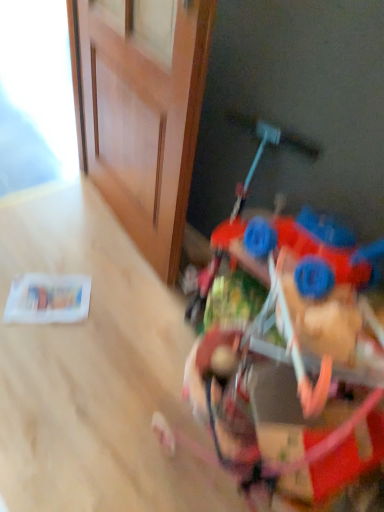
In order to face wooden door at upper left, should I rotate leftwards or rightwards?

Rotate left and turn 11.031 degrees.

The height and width of the screenshot is (512, 384). What do you see at coordinates (143, 116) in the screenshot?
I see `wooden door at upper left` at bounding box center [143, 116].

This screenshot has width=384, height=512. I want to click on wooden door at upper left, so click(143, 116).

You are a GUI agent. You are given a task and a screenshot of the screen. Output one action in this format:
    pyautogui.click(x=<x>, y=<y>)
    Task: Click on the plastic toy car at lower right
    The height and width of the screenshot is (512, 384).
    Given the screenshot: What is the action you would take?
    pyautogui.click(x=290, y=352)

This screenshot has height=512, width=384. What do you see at coordinates (290, 352) in the screenshot? I see `plastic toy car at lower right` at bounding box center [290, 352].

In order to click on wooden door at upper left in this screenshot , I will do `click(143, 116)`.

Considering the relative positions of wooden door at upper left and plastic toy car at lower right in the image provided, is wooden door at upper left to the right of plastic toy car at lower right from the viewer's perspective?

In fact, wooden door at upper left is to the left of plastic toy car at lower right.

Considering the relative positions of wooden door at upper left and plastic toy car at lower right in the image provided, is wooden door at upper left in front of plastic toy car at lower right?

No, wooden door at upper left is further to the viewer.

Is point (188, 40) behind point (334, 451)?

Yes, point (188, 40) is farther from viewer.

From the image's perspective, is wooden door at upper left above or below plastic toy car at lower right?

wooden door at upper left is situated higher than plastic toy car at lower right in the image.

From a real-world perspective, is wooden door at upper left on top of plastic toy car at lower right?

Indeed, from a real-world perspective, wooden door at upper left stands above plastic toy car at lower right.

Is wooden door at upper left wider than plastic toy car at lower right?

No.

Is wooden door at upper left taller than plastic toy car at lower right?

Yes.

Who is bigger, wooden door at upper left or plastic toy car at lower right?

With larger size is plastic toy car at lower right.

Could plastic toy car at lower right be considered to be inside wooden door at upper left?

That's incorrect, plastic toy car at lower right is not inside wooden door at upper left.

Is wooden door at upper left beside plastic toy car at lower right?

No, wooden door at upper left is not touching plastic toy car at lower right.

In the scene shown: Is wooden door at upper left facing away from plastic toy car at lower right?

That's not correct — wooden door at upper left is not looking away from plastic toy car at lower right.

What's the angular difference between wooden door at upper left and plastic toy car at lower right's facing directions?

The angle between the facing direction of wooden door at upper left and the facing direction of plastic toy car at lower right is 54.5 degrees.

Locate an element on the screen. toy that is under the wooden door at upper left (from a real-world perspective) is located at coordinates click(x=290, y=352).

Between plastic toy car at lower right and wooden door at upper left, which one appears on the left side from the viewer's perspective?

wooden door at upper left.

Based on the photo, which is behind, plastic toy car at lower right or wooden door at upper left?

wooden door at upper left is further from the camera.

Between point (334, 238) and point (136, 125), which one is positioned behind?

Positioned behind is point (136, 125).

From the image's perspective, is plastic toy car at lower right positioned above or below wooden door at upper left?

plastic toy car at lower right is situated lower than wooden door at upper left in the image.

From a real-world perspective, is plastic toy car at lower right on wooden door at upper left?

No, from a real-world perspective, plastic toy car at lower right is not above wooden door at upper left.

Which object is thinner, plastic toy car at lower right or wooden door at upper left?

Thinner between the two is wooden door at upper left.

In terms of height, does plastic toy car at lower right look taller or shorter compared to wooden door at upper left?

Considering their sizes, plastic toy car at lower right has less height than wooden door at upper left.

Is plastic toy car at lower right smaller than wooden door at upper left?

No, plastic toy car at lower right is not smaller than wooden door at upper left.

Is plastic toy car at lower right inside the boundaries of wooden door at upper left, or outside?

plastic toy car at lower right lies outside wooden door at upper left.

Is plastic toy car at lower right with wooden door at upper left?

No, plastic toy car at lower right is not in contact with wooden door at upper left.

Is plastic toy car at lower right turned away from wooden door at upper left?

No, plastic toy car at lower right's orientation is not away from wooden door at upper left.

I want to click on toy that is in front of the wooden door at upper left, so click(x=290, y=352).

Find the location of a particular element. The width and height of the screenshot is (384, 512). toy beneath the wooden door at upper left (from a real-world perspective) is located at coordinates (290, 352).

This screenshot has height=512, width=384. I want to click on toy on the right of wooden door at upper left, so click(290, 352).